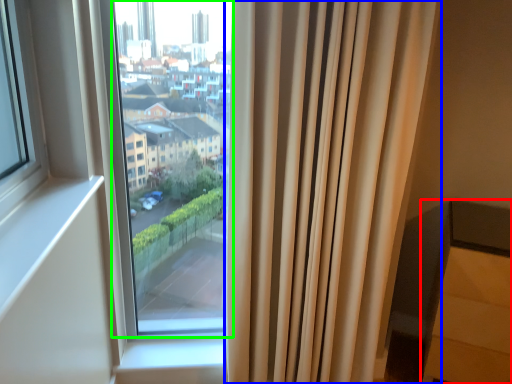
Question: Which is farther away from furniture (highlighted by a red box)? curtain (highlighted by a blue box) or bay window (highlighted by a green box)?

Choices:
 (A) curtain
 (B) bay window

Answer: (B)